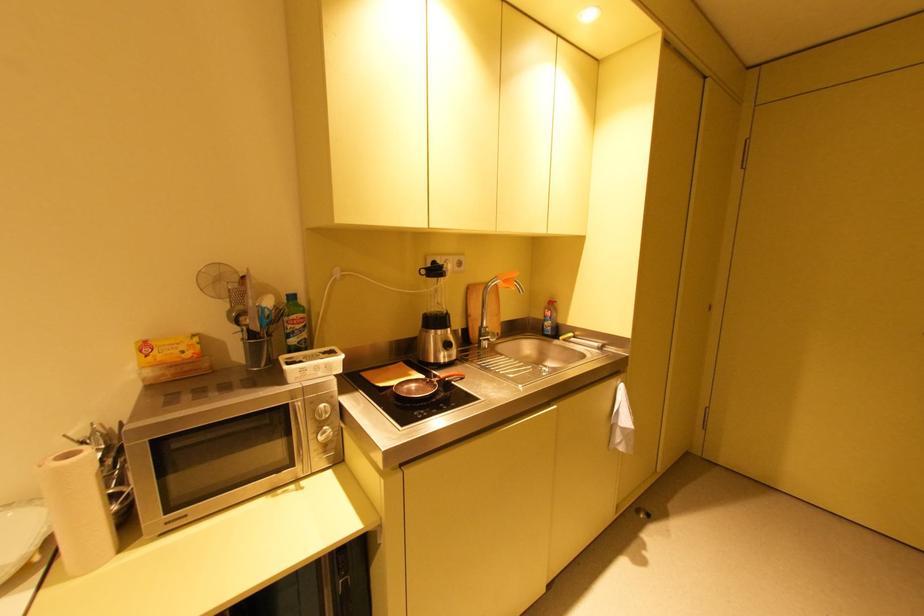
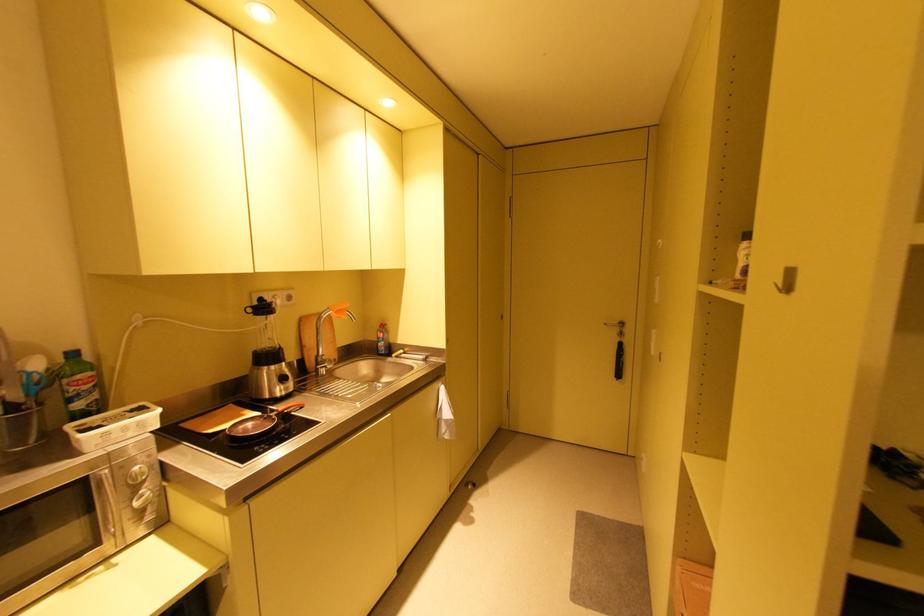
Question: The images are taken continuously from a first-person perspective. In which direction are you moving?

Choices:
 (A) Left
 (B) Right
 (C) Forward
 (D) Backward

Answer: (D)